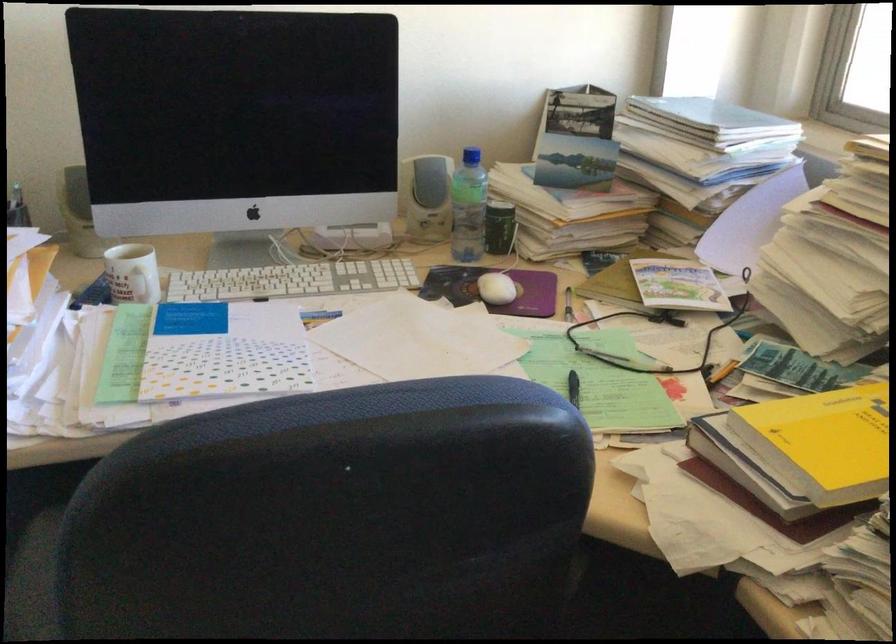
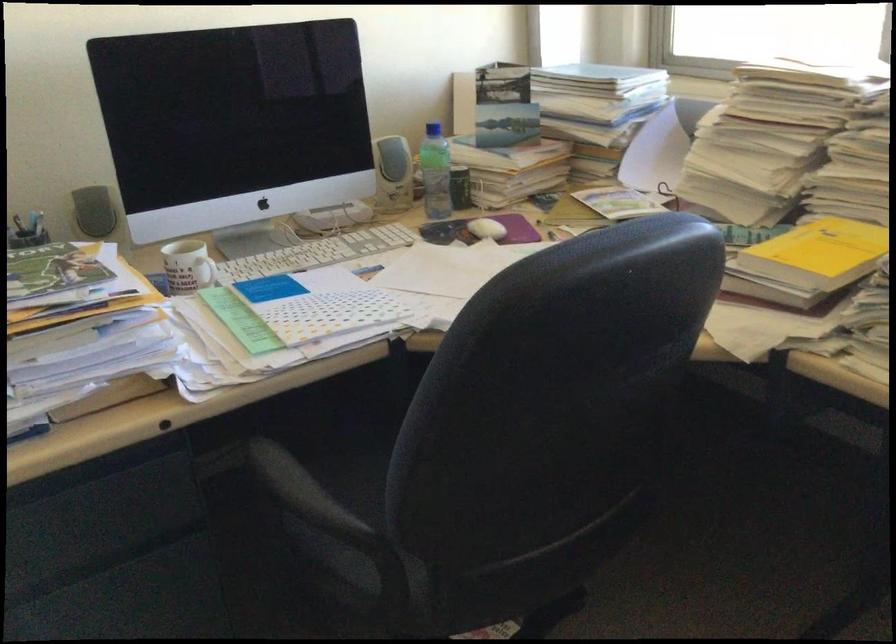
The point at (142, 289) is marked in the first image. Where is the corresponding point in the second image?

(204, 272)